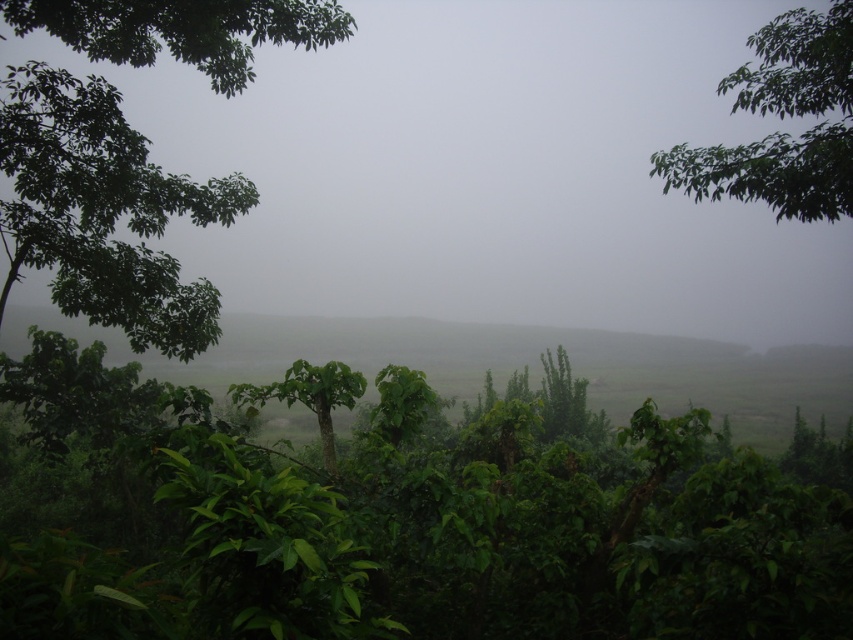
Question: Among these objects, which one is farthest from the camera?

Choices:
 (A) green leafy vegetation at center
 (B) green leafy tree at center

Answer: (B)

Question: Is green leafy tree at left smaller than green leafy tree at upper right?

Choices:
 (A) yes
 (B) no

Answer: (B)

Question: Can you confirm if green leafy vegetation at center is smaller than green leafy tree at upper right?

Choices:
 (A) no
 (B) yes

Answer: (B)

Question: Estimate the real-world distances between objects in this image. Which object is farther from the foggy mist at center?

Choices:
 (A) green leafy tree at upper right
 (B) green leafy tree at left
 (C) green leafy tree at center
 (D) green leafy vegetation at center

Answer: (C)

Question: Is green leafy vegetation at center to the left of green leafy tree at center from the viewer's perspective?

Choices:
 (A) no
 (B) yes

Answer: (A)

Question: Which point is closer to the camera taking this photo?

Choices:
 (A) (310, 381)
 (B) (189, 104)
 (C) (836, 152)
 (D) (102, 77)

Answer: (A)